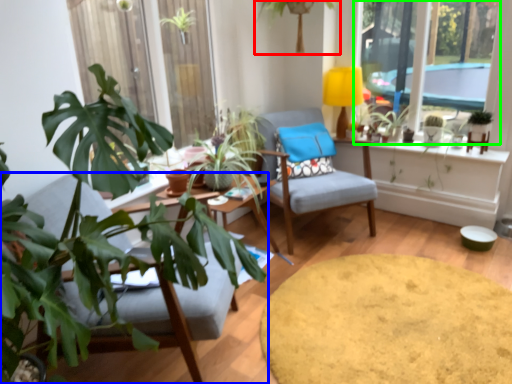
Question: Which object is positioned closest to houseplant (highlighted by a red box)? Select from chair (highlighted by a blue box) and window (highlighted by a green box).

Choices:
 (A) chair
 (B) window

Answer: (B)